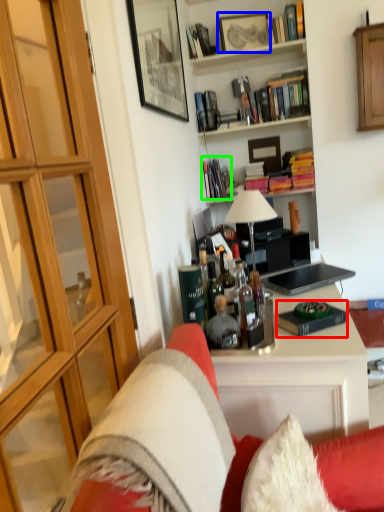
Question: Which object is the closest to the book (highlighted by a red box)? Choose among these: picture frame (highlighted by a blue box) or book (highlighted by a green box).

Choices:
 (A) picture frame
 (B) book

Answer: (B)